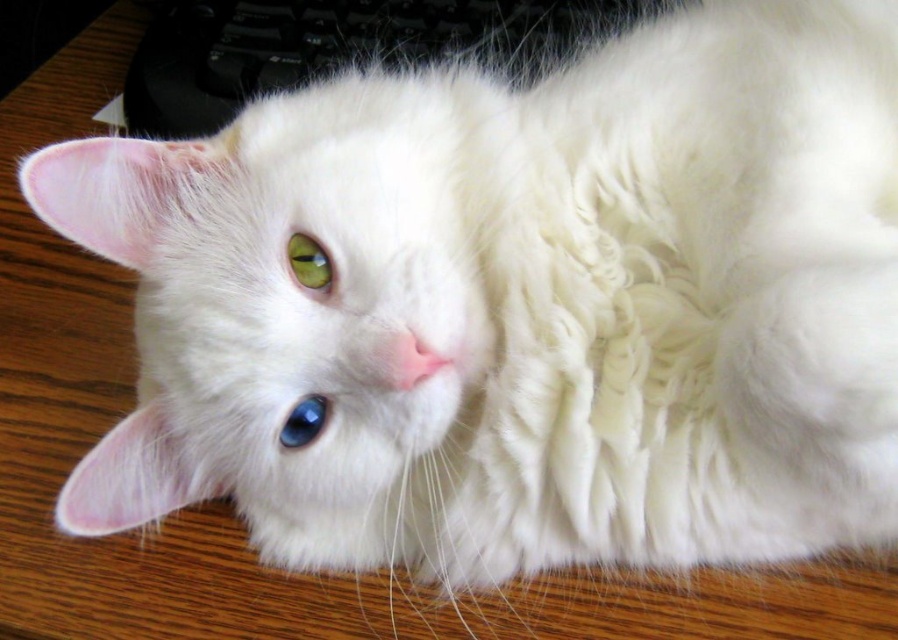
From the picture: You are a cat owner who wants to place a small toy between the black plastic keyboard at upper center and the green glossy eye at center. Since the keyboard is wider than the eye, will the toy fit between them?

The black plastic keyboard at upper center is wider than the green glossy eye at center. The toy can fit between them as long as its width is less than the difference in their widths.

You are trying to take a photo of the blue glossy eye at center without including the black plastic keyboard at upper center in the frame. Given their positions, is this possible?

The black plastic keyboard at upper center is taller than blue glossy eye at center, so it might be possible to angle the camera downward to exclude the keyboard while focusing on the eye.